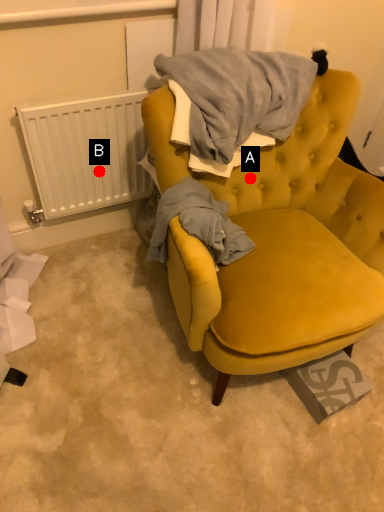
Question: Two points are circled on the image, labeled by A and B beside each circle. Which point appears farthest from the camera in this image?

Choices:
 (A) A is further
 (B) B is further

Answer: (B)